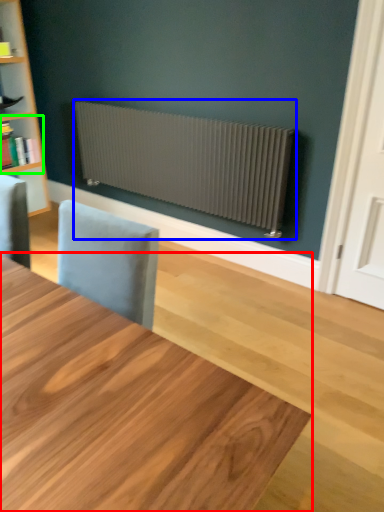
Question: Which object is the farthest from table (highlighted by a red box)? Choose among these: radiator (highlighted by a blue box) or shelf (highlighted by a green box).

Choices:
 (A) radiator
 (B) shelf

Answer: (B)